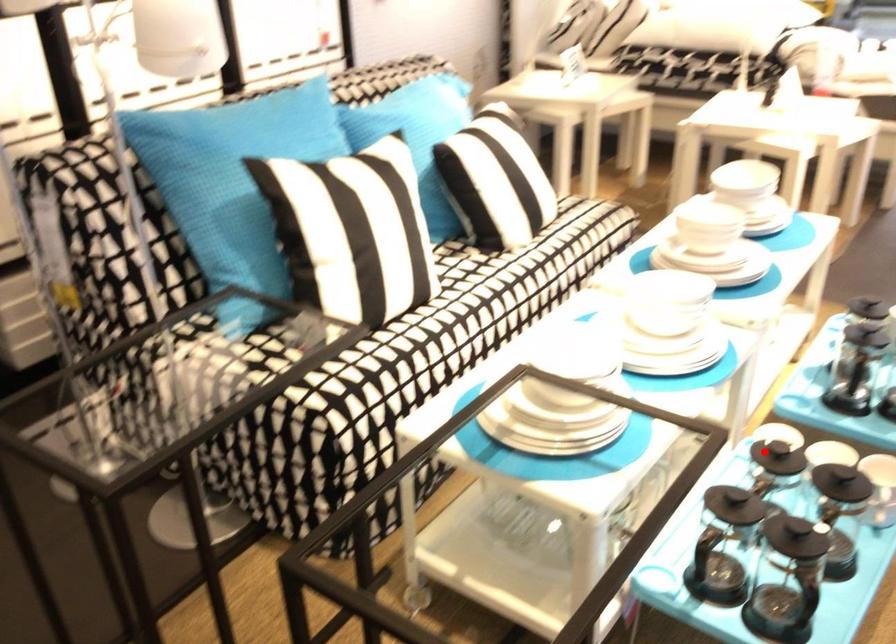
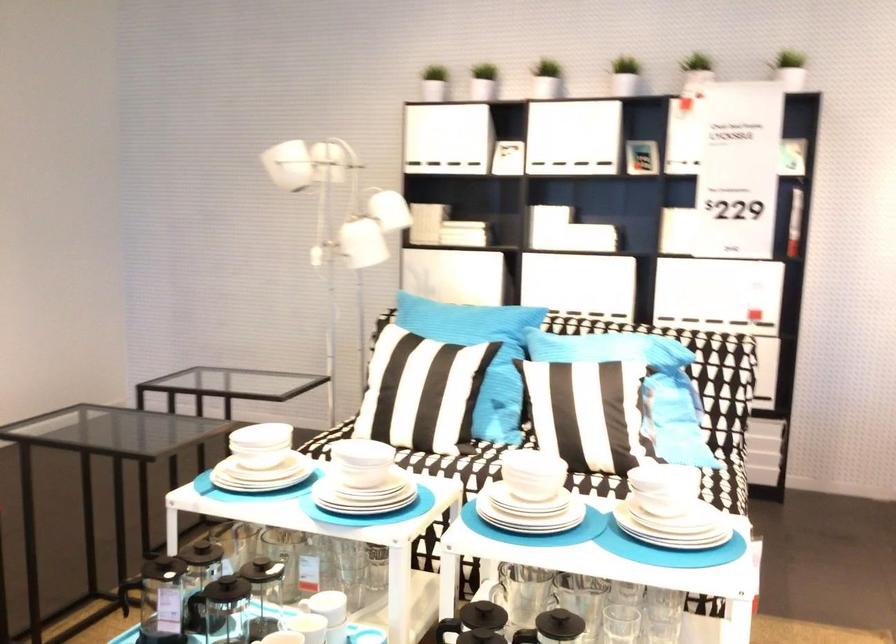
Where in the second image is the point corresponding to the highlighted location from the first image?

(264, 558)